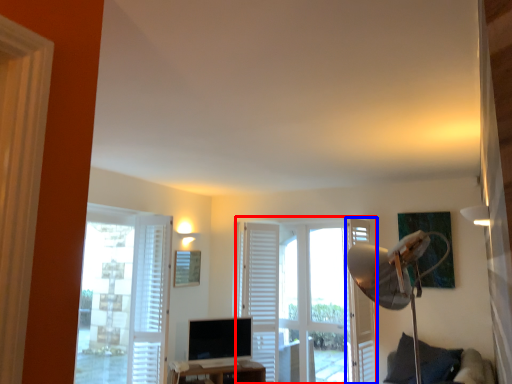
Question: Which object is further to the camera taking this photo, door (highlighted by a red box) or screen door (highlighted by a blue box)?

Choices:
 (A) door
 (B) screen door

Answer: (A)